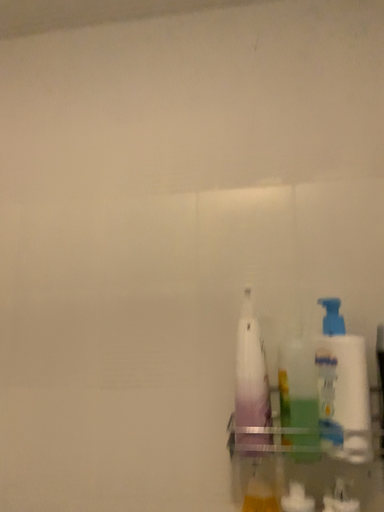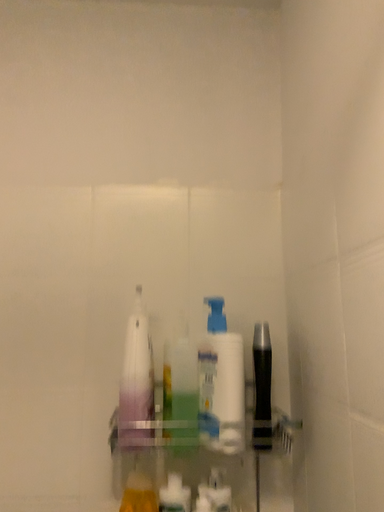
Question: How did the camera likely rotate when shooting the video?

Choices:
 (A) rotated left
 (B) rotated right

Answer: (B)